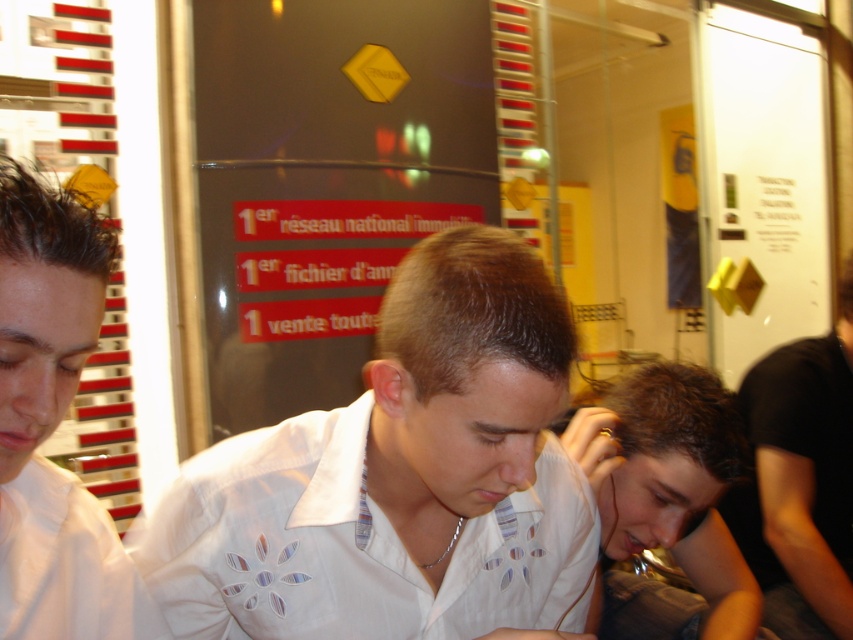
Is white fabric shirt at center shorter than white matte shirt at left?

No, white fabric shirt at center is not shorter than white matte shirt at left.

Where is `white fabric shirt at center`? The width and height of the screenshot is (853, 640). white fabric shirt at center is located at coordinates (399, 477).

Can you confirm if white fabric shirt at center is bigger than black matte shirt at right?

No, white fabric shirt at center is not bigger than black matte shirt at right.

Does white fabric shirt at center come behind black matte shirt at right?

That is False.

Does point (563, 595) lie behind point (766, 509)?

No, it is not.

This screenshot has height=640, width=853. Find the location of `white fabric shirt at center`. white fabric shirt at center is located at coordinates (399, 477).

This screenshot has width=853, height=640. What are the coordinates of `white fabric shirt at center` in the screenshot? It's located at (399, 477).

Is point (347, 436) positioned in front of point (738, 435)?

That is True.

Between point (428, 310) and point (738, 614), which one is positioned behind?

Point (738, 614)

Image resolution: width=853 pixels, height=640 pixels. Find the location of `white fabric shirt at center`. white fabric shirt at center is located at coordinates coord(399,477).